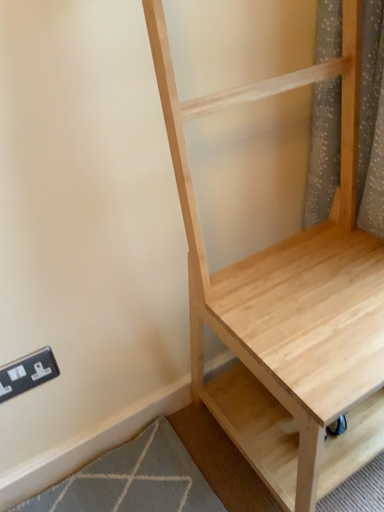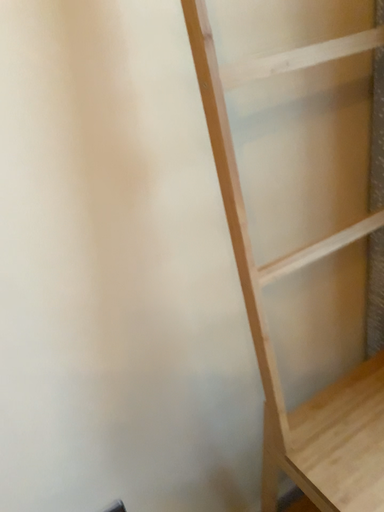
Question: How did the camera likely rotate when shooting the video?

Choices:
 (A) rotated downward
 (B) rotated upward

Answer: (B)